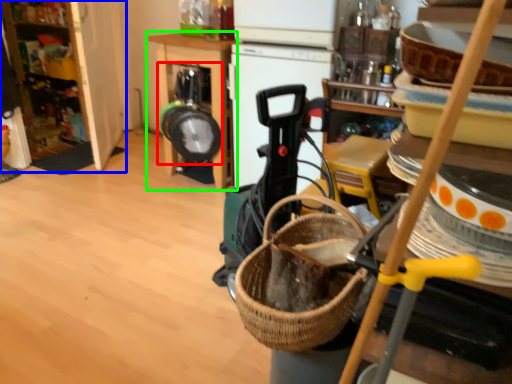
Question: Which object is the farthest from appliance (highlighted by a red box)? Choose among these: cabinetry (highlighted by a blue box) or furniture (highlighted by a green box).

Choices:
 (A) cabinetry
 (B) furniture

Answer: (A)